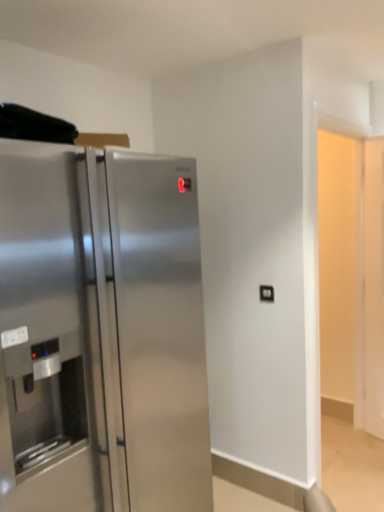
Question: Would you consider black plastic outlet at center to be distant from stainless steel refrigerator at left?

Choices:
 (A) yes
 (B) no

Answer: (A)

Question: Can you confirm if black plastic outlet at center is thinner than stainless steel refrigerator at left?

Choices:
 (A) yes
 (B) no

Answer: (A)

Question: Would you say stainless steel refrigerator at left is part of black plastic outlet at center's contents?

Choices:
 (A) yes
 (B) no

Answer: (B)

Question: Are black plastic outlet at center and stainless steel refrigerator at left making contact?

Choices:
 (A) yes
 (B) no

Answer: (B)

Question: Does black plastic outlet at center have a greater width compared to stainless steel refrigerator at left?

Choices:
 (A) yes
 (B) no

Answer: (B)

Question: Can you confirm if black plastic outlet at center is shorter than stainless steel refrigerator at left?

Choices:
 (A) yes
 (B) no

Answer: (A)

Question: Could you tell me if stainless steel refrigerator at left is facing black plastic outlet at center?

Choices:
 (A) yes
 (B) no

Answer: (B)

Question: Is stainless steel refrigerator at left not within black plastic outlet at center?

Choices:
 (A) no
 (B) yes

Answer: (B)

Question: Is stainless steel refrigerator at left positioned before black plastic outlet at center?

Choices:
 (A) yes
 (B) no

Answer: (A)

Question: Is stainless steel refrigerator at left far away from black plastic outlet at center?

Choices:
 (A) no
 (B) yes

Answer: (B)

Question: Is black plastic outlet at center at the back of stainless steel refrigerator at left?

Choices:
 (A) yes
 (B) no

Answer: (B)

Question: Is stainless steel refrigerator at left taller than black plastic outlet at center?

Choices:
 (A) no
 (B) yes

Answer: (B)

Question: Based on their sizes in the image, would you say black plastic outlet at center is bigger or smaller than stainless steel refrigerator at left?

Choices:
 (A) small
 (B) big

Answer: (A)